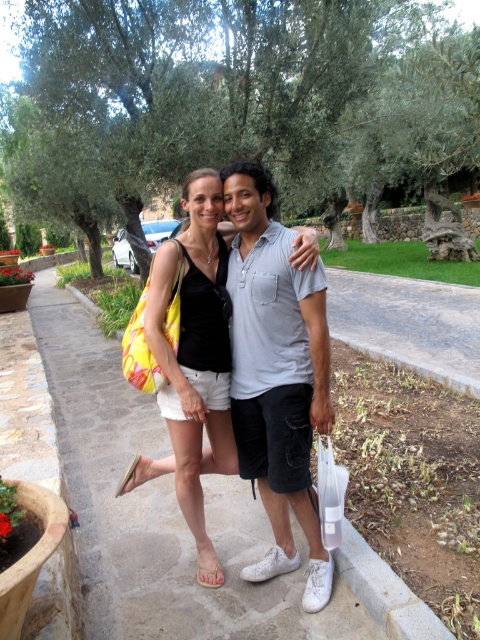
Which is more to the right, matte black tank top at center or beige fabric sandal at lower center?

Positioned to the right is beige fabric sandal at lower center.

Can you confirm if matte black tank top at center is shorter than beige fabric sandal at lower center?

Incorrect, matte black tank top at center's height does not fall short of beige fabric sandal at lower center's.

Is point (203, 378) positioned before point (213, 577)?

Yes.

Where is `matte black tank top at center`? The image size is (480, 640). matte black tank top at center is located at coordinates (192, 355).

In the scene shown: Measure the distance between light gray cotton shirt at center and matte black tank top at center.

light gray cotton shirt at center and matte black tank top at center are 10.40 inches apart from each other.

Does light gray cotton shirt at center come in front of matte black tank top at center?

Yes.

Locate an element on the screen. light gray cotton shirt at center is located at coordinates (276, 374).

From the picture: Does light gray cotton shirt at center have a lesser height compared to beige fabric sandal at lower center?

No, light gray cotton shirt at center is not shorter than beige fabric sandal at lower center.

Does point (288, 490) come closer to viewer compared to point (208, 568)?

Yes, point (288, 490) is in front of point (208, 568).

Who is more forward, (245, 426) or (197, 573)?

Point (245, 426)

At what (x,y) coordinates should I click in order to perform the action: click on light gray cotton shirt at center. Please return your answer as a coordinate pair (x, y). This screenshot has height=640, width=480. Looking at the image, I should click on (276, 374).